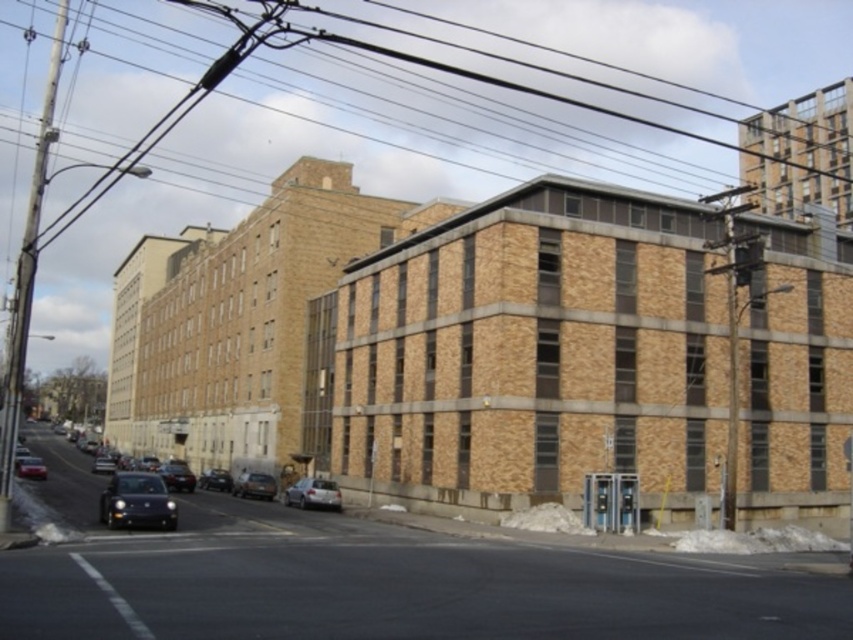
Is point (119, 476) less distant than point (202, 483)?

Yes, it is.

Does shiny black car at lower left have a greater height compared to shiny black sedan at center?

No.

Identify the location of shiny black car at lower left. (136, 500).

Between silver metallic car at center and shiny black sedan at center-left, which one has less height?

With less height is silver metallic car at center.

This screenshot has width=853, height=640. What do you see at coordinates (312, 493) in the screenshot?
I see `silver metallic car at center` at bounding box center [312, 493].

Is point (294, 488) positioned before point (173, 477)?

Yes.

This screenshot has width=853, height=640. In order to click on silver metallic car at center in this screenshot , I will do `click(312, 493)`.

In the scene shown: Is shiny black car at lower left thinner than shiny black sedan at lower left?

Yes, shiny black car at lower left is thinner than shiny black sedan at lower left.

In order to click on shiny black car at lower left in this screenshot , I will do `click(136, 500)`.

Where is `shiny black car at lower left`? shiny black car at lower left is located at coordinates (136, 500).